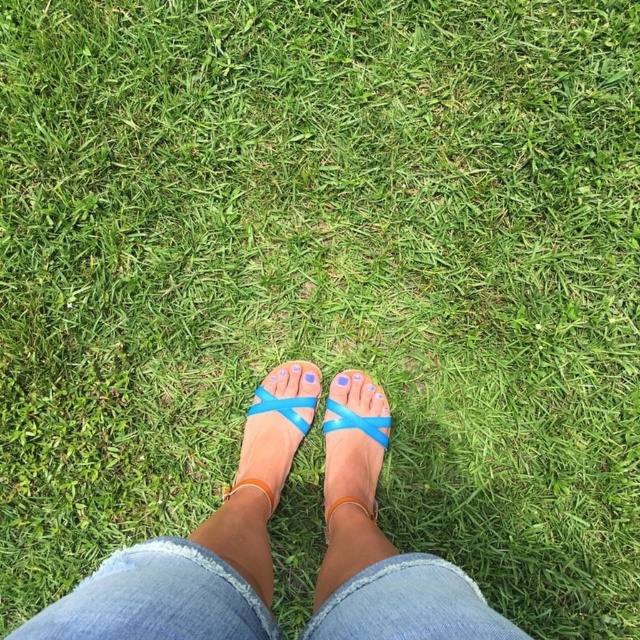
You are a photographer trying to capture the translucent plastic sandals at center and the translucent plastic sandal at center in a clear photo. Which object should you focus on first to ensure both are in focus?

The translucent plastic sandals at center is below the translucent plastic sandal at center, so you should focus on the translucent plastic sandals at center first to ensure both are in focus.

From the picture: You are a photographer setting up a shoot in the scene described. You need to ensure that the translucent plastic sandals at center are visible in the final shot. Given their position relative to the blue matte toe at center, what adjustment should you make to the camera angle?

The translucent plastic sandals at center are positioned under the blue matte toe at center. To ensure visibility, adjust the camera angle to tilt upwards slightly so the sandals are not obscured by the toe.

Consider the image. You are a photographer setting up a shoot in this scene. You need to place a small prop exactly at the point marked as point (202, 545). What object will the prop be placed on top of?

The prop will be placed on top of the translucent plastic sandals at center located at point (202, 545).